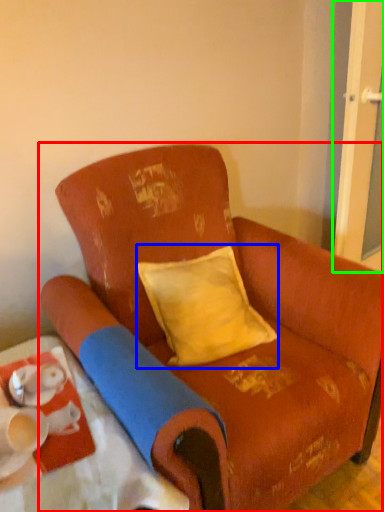
Question: Which is farther away from chair (highlighted by a red box)? pillow (highlighted by a blue box) or screen door (highlighted by a green box)?

Choices:
 (A) pillow
 (B) screen door

Answer: (B)